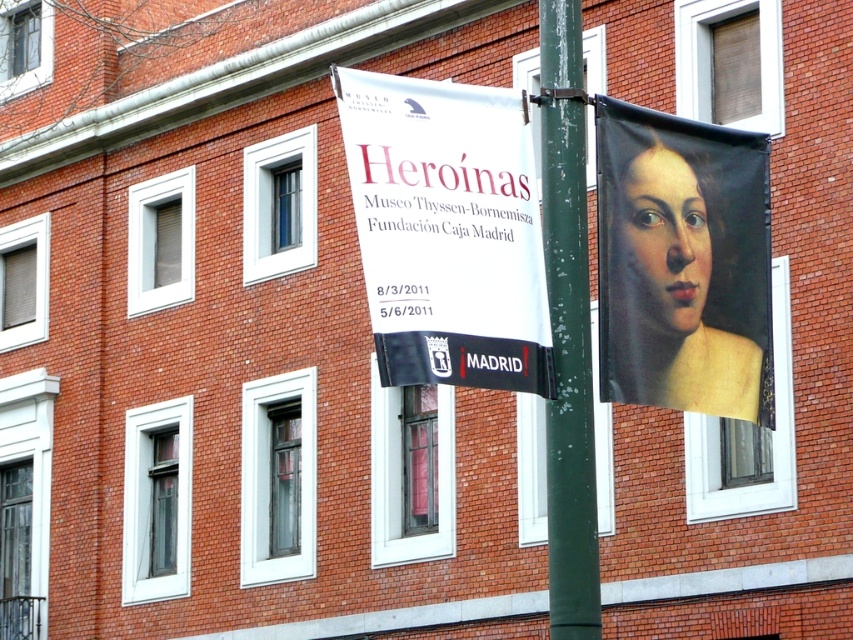
Does white paper banner at upper center have a larger size compared to smooth canvas portrait at right?

Indeed, white paper banner at upper center has a larger size compared to smooth canvas portrait at right.

Does white paper banner at upper center appear over smooth canvas portrait at right?

Correct, white paper banner at upper center is located above smooth canvas portrait at right.

This screenshot has width=853, height=640. In order to click on white paper banner at upper center in this screenshot , I will do `click(447, 230)`.

Where is `white paper banner at upper center`? white paper banner at upper center is located at coordinates pos(447,230).

Describe the element at coordinates (683, 262) in the screenshot. I see `smooth canvas portrait at right` at that location.

Is point (640, 344) less distant than point (577, 8)?

No, it is not.

Between point (610, 388) and point (579, 448), which one is positioned behind?

The point (610, 388) is more distant.

The image size is (853, 640). In order to click on smooth canvas portrait at right in this screenshot , I will do `click(683, 262)`.

Between white paper banner at upper center and green painted metal pole at center, which one is positioned higher?

white paper banner at upper center is higher up.

Between point (480, 304) and point (564, 177), which one is positioned in front?

Point (480, 304)

Who is more forward, (381, 380) or (579, 172)?

Positioned in front is point (381, 380).

Find the location of a particular element. Image resolution: width=853 pixels, height=640 pixels. white paper banner at upper center is located at coordinates (447, 230).